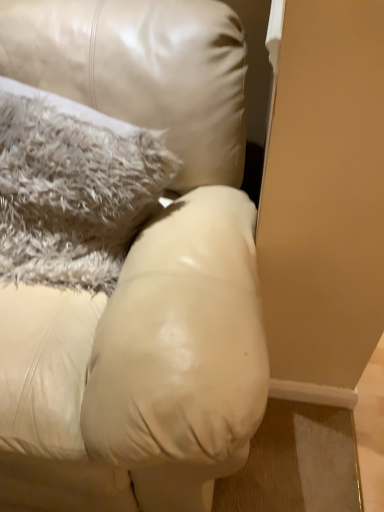
Question: Is fuzzy gray pillow at upper left far from matte leather couch at center?

Choices:
 (A) yes
 (B) no

Answer: (B)

Question: Can you confirm if fuzzy gray pillow at upper left is smaller than matte leather couch at center?

Choices:
 (A) yes
 (B) no

Answer: (A)

Question: Could you tell me if fuzzy gray pillow at upper left is turned towards matte leather couch at center?

Choices:
 (A) yes
 (B) no

Answer: (A)

Question: Does fuzzy gray pillow at upper left appear on the left side of matte leather couch at center?

Choices:
 (A) yes
 (B) no

Answer: (B)

Question: Is fuzzy gray pillow at upper left bigger than matte leather couch at center?

Choices:
 (A) no
 (B) yes

Answer: (A)

Question: Can you confirm if fuzzy gray pillow at upper left is wider than matte leather couch at center?

Choices:
 (A) no
 (B) yes

Answer: (A)

Question: Can you confirm if matte leather couch at center is taller than fuzzy gray pillow at upper left?

Choices:
 (A) yes
 (B) no

Answer: (A)

Question: Does matte leather couch at center have a lesser height compared to fuzzy gray pillow at upper left?

Choices:
 (A) yes
 (B) no

Answer: (B)

Question: From the image's perspective, is matte leather couch at center located beneath fuzzy gray pillow at upper left?

Choices:
 (A) yes
 (B) no

Answer: (A)

Question: Is matte leather couch at center at the left side of fuzzy gray pillow at upper left?

Choices:
 (A) no
 (B) yes

Answer: (B)

Question: Can you confirm if matte leather couch at center is thinner than fuzzy gray pillow at upper left?

Choices:
 (A) yes
 (B) no

Answer: (B)

Question: From the image's perspective, is matte leather couch at center on top of fuzzy gray pillow at upper left?

Choices:
 (A) no
 (B) yes

Answer: (A)

Question: From the image's perspective, relative to matte leather couch at center, is fuzzy gray pillow at upper left above or below?

Choices:
 (A) below
 (B) above

Answer: (B)